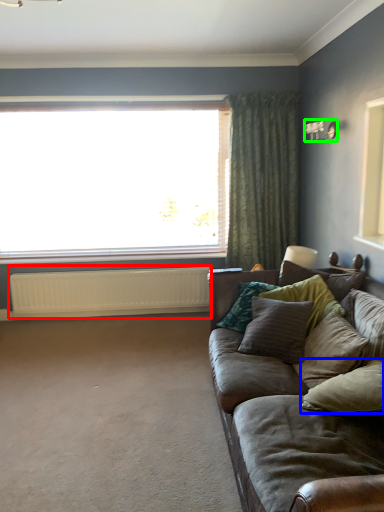
Question: Which object is positioned closest to radiator (highlighted by a red box)? Select from pillow (highlighted by a blue box) and light fixture (highlighted by a green box).

Choices:
 (A) pillow
 (B) light fixture

Answer: (B)